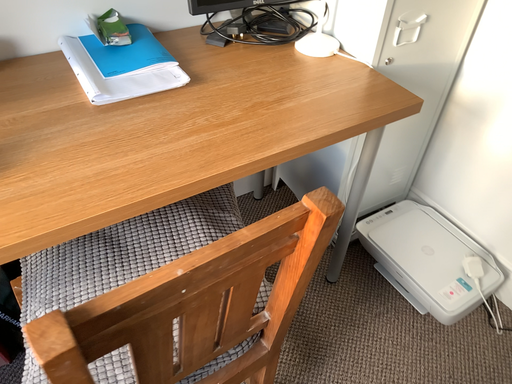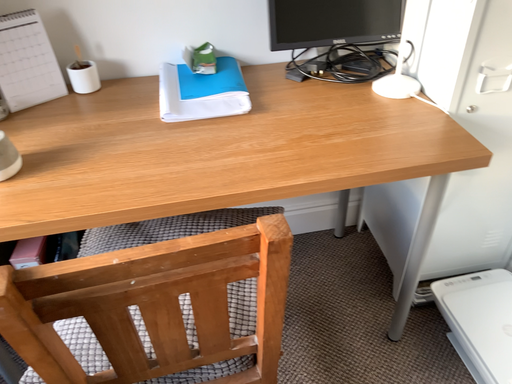
Question: How did the camera likely rotate when shooting the video?

Choices:
 (A) rotated downward
 (B) rotated upward

Answer: (B)